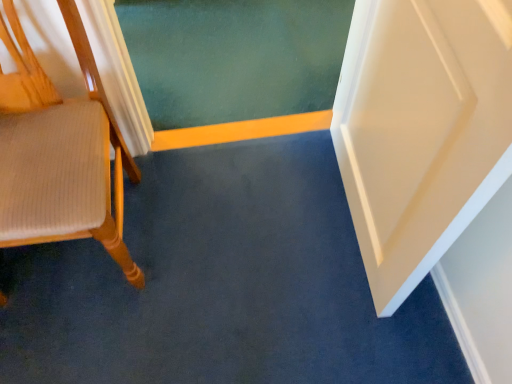
What do you see at coordinates (241, 130) in the screenshot? I see `yellow wood strip at center` at bounding box center [241, 130].

Locate an element on the screen. This screenshot has height=384, width=512. yellow wood strip at center is located at coordinates (241, 130).

At what (x,y) coordinates should I click in order to perform the action: click on wooden chair at left. Please return your answer as a coordinate pair (x, y). The image size is (512, 384). Looking at the image, I should click on (60, 152).

Describe the element at coordinates (60, 152) in the screenshot. Image resolution: width=512 pixels, height=384 pixels. I see `wooden chair at left` at that location.

You are a GUI agent. You are given a task and a screenshot of the screen. Output one action in this format:
    pyautogui.click(x=<x>, y=<y>)
    Task: Click on the yellow wood strip at center
    The width and height of the screenshot is (512, 384).
    Given the screenshot: What is the action you would take?
    pyautogui.click(x=241, y=130)

Considering the positions of objects wooden chair at left and yellow wood strip at center in the image provided, who is more to the left, wooden chair at left or yellow wood strip at center?

wooden chair at left is more to the left.

Is wooden chair at left behind yellow wood strip at center?

No, it is not.

Which point is more distant from viewer, (99, 211) or (198, 139)?

The point (198, 139) is farther.

From the image's perspective, which one is positioned higher, wooden chair at left or yellow wood strip at center?

yellow wood strip at center, from the image's perspective.

From a real-world perspective, who is located lower, wooden chair at left or yellow wood strip at center?

yellow wood strip at center.

In terms of width, does wooden chair at left look wider or thinner when compared to yellow wood strip at center?

wooden chair at left is wider than yellow wood strip at center.

From their relative heights in the image, would you say wooden chair at left is taller or shorter than yellow wood strip at center?

wooden chair at left is taller than yellow wood strip at center.

Between wooden chair at left and yellow wood strip at center, which one has smaller size?

yellow wood strip at center.

Is yellow wood strip at center completely or partially inside wooden chair at left?

No, yellow wood strip at center is not a part of wooden chair at left.

Is wooden chair at left next to yellow wood strip at center and touching it?

No, wooden chair at left is not with yellow wood strip at center.

Does wooden chair at left turn towards yellow wood strip at center?

A: No, wooden chair at left is not oriented towards yellow wood strip at center.

The height and width of the screenshot is (384, 512). I want to click on strip that is behind the wooden chair at left, so click(241, 130).

Which object is positioned more to the left, yellow wood strip at center or wooden chair at left?

wooden chair at left.

Relative to wooden chair at left, is yellow wood strip at center in front or behind?

Visually, yellow wood strip at center is located behind wooden chair at left.

Considering the points (249, 122) and (22, 179), which point is in front, point (249, 122) or point (22, 179)?

The point (22, 179) is more forward.

From the image's perspective, is yellow wood strip at center below wooden chair at left?

No, from the image's perspective, yellow wood strip at center is not beneath wooden chair at left.

From a real-world perspective, which is physically below, yellow wood strip at center or wooden chair at left?

In real-world perspective, yellow wood strip at center is lower.

In terms of width, does yellow wood strip at center look wider or thinner when compared to wooden chair at left?

Considering their sizes, yellow wood strip at center looks slimmer than wooden chair at left.

Looking at this image, between yellow wood strip at center and wooden chair at left, which one has more height?

With more height is wooden chair at left.

Can you confirm if yellow wood strip at center is smaller than wooden chair at left?

Correct, yellow wood strip at center occupies less space than wooden chair at left.

From the picture: Do you think yellow wood strip at center is within wooden chair at left, or outside of it?

yellow wood strip at center is spatially situated outside wooden chair at left.

Based on the photo, are yellow wood strip at center and wooden chair at left far apart?

No.

Is yellow wood strip at center oriented away from wooden chair at left?

No, yellow wood strip at center is not facing away from wooden chair at left.

How far apart are yellow wood strip at center and wooden chair at left?

yellow wood strip at center is 23.15 inches away from wooden chair at left.

At what (x,y) coordinates should I click in order to perform the action: click on chair to the left of yellow wood strip at center. Please return your answer as a coordinate pair (x, y). This screenshot has width=512, height=384. Looking at the image, I should click on (60, 152).

Locate an element on the screen. The image size is (512, 384). strip on the right of wooden chair at left is located at coordinates (241, 130).

You are a GUI agent. You are given a task and a screenshot of the screen. Output one action in this format:
    pyautogui.click(x=<x>, y=<y>)
    Task: Click on the chair that is in front of the yellow wood strip at center
    Image resolution: width=512 pixels, height=384 pixels.
    Given the screenshot: What is the action you would take?
    pyautogui.click(x=60, y=152)